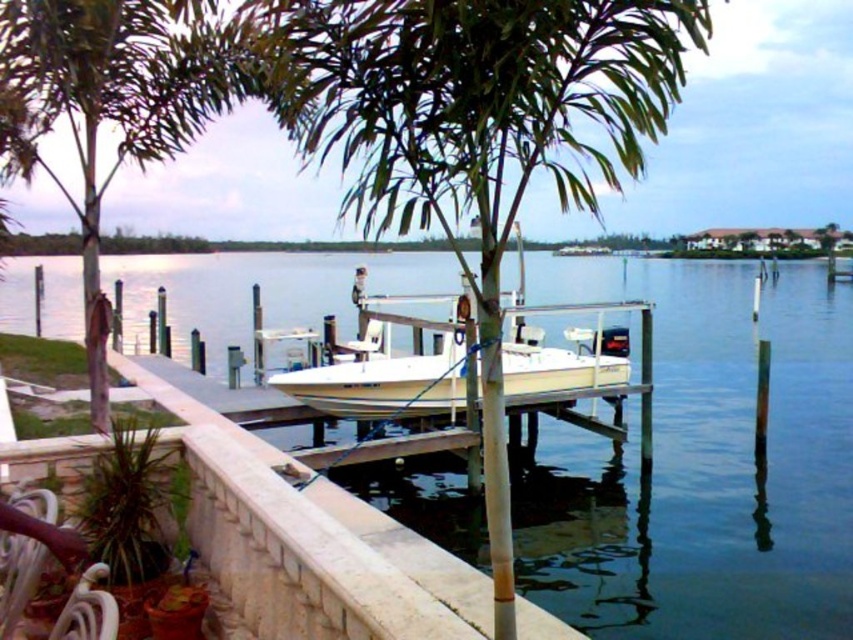
Measure the distance between point (x=846, y=426) and camera.

Point (x=846, y=426) and camera are 15.71 meters apart from each other.

Between clear blue water at center and white matte boat at center, which one is positioned lower?

white matte boat at center is lower down.

Describe the element at coordinates (701, 465) in the screenshot. I see `clear blue water at center` at that location.

Identify the location of clear blue water at center. (701, 465).

Does green leafy palm tree at center have a lesser height compared to white matte boat at center?

In fact, green leafy palm tree at center may be taller than white matte boat at center.

Locate an element on the screen. The height and width of the screenshot is (640, 853). green leafy palm tree at center is located at coordinates (474, 131).

The image size is (853, 640). Describe the element at coordinates (701, 465) in the screenshot. I see `clear blue water at center` at that location.

Where is `clear blue water at center`? This screenshot has height=640, width=853. clear blue water at center is located at coordinates (701, 465).